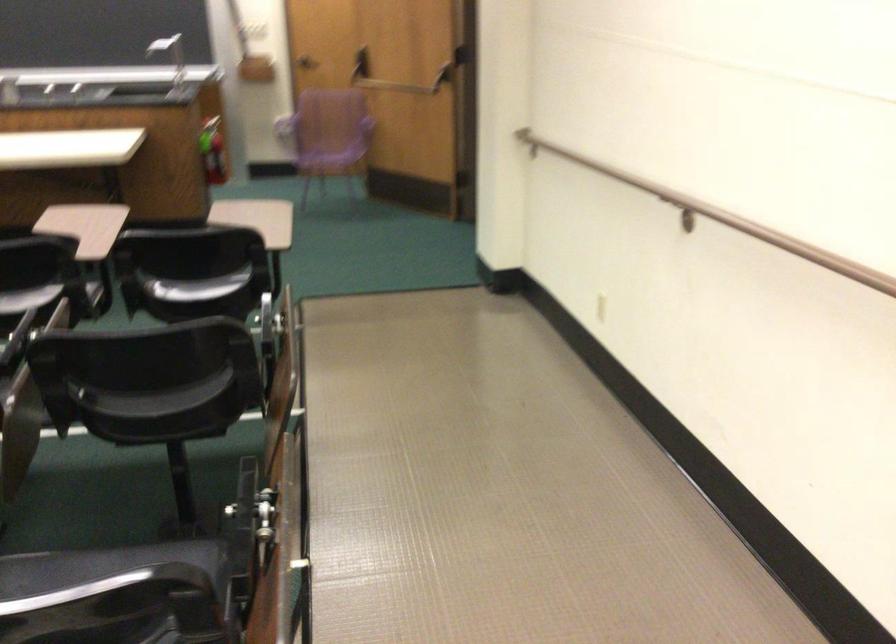
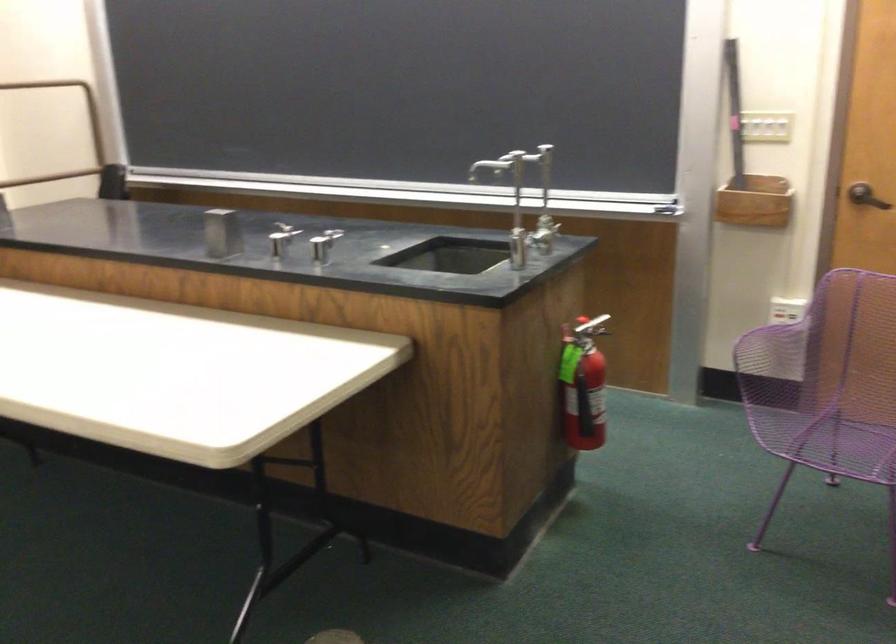
Find the pixel in the second image that matches [330,152] in the first image.

(851, 415)